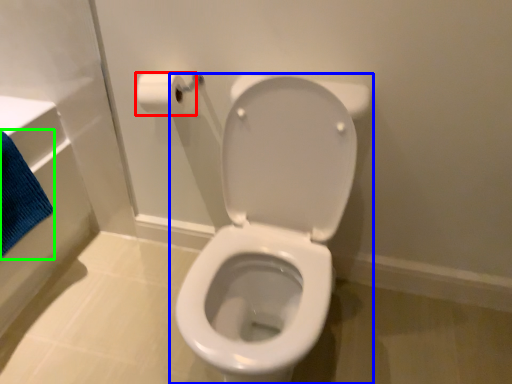
Question: Based on their relative distances, which object is farther from toilet paper (highlighted by a red box)? Choose from toilet (highlighted by a blue box) and bath towel (highlighted by a green box).

Choices:
 (A) toilet
 (B) bath towel

Answer: (B)